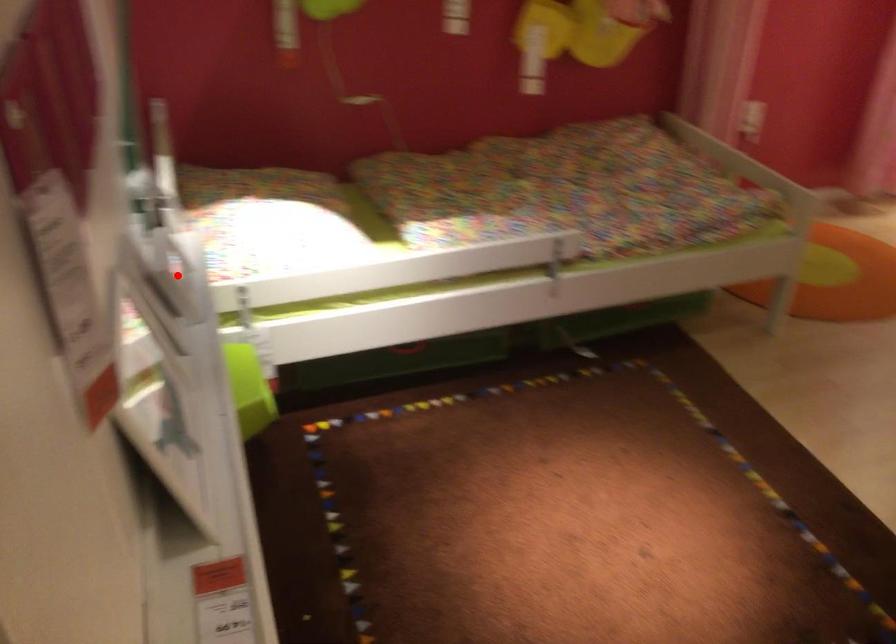
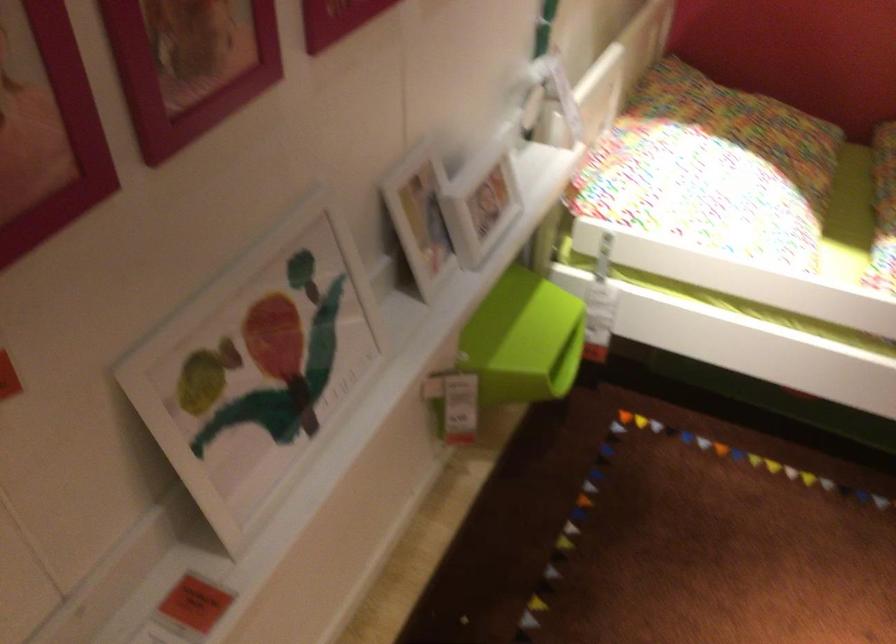
Locate, in the second image, the point that corresponds to the highlighted location in the first image.

(479, 200)